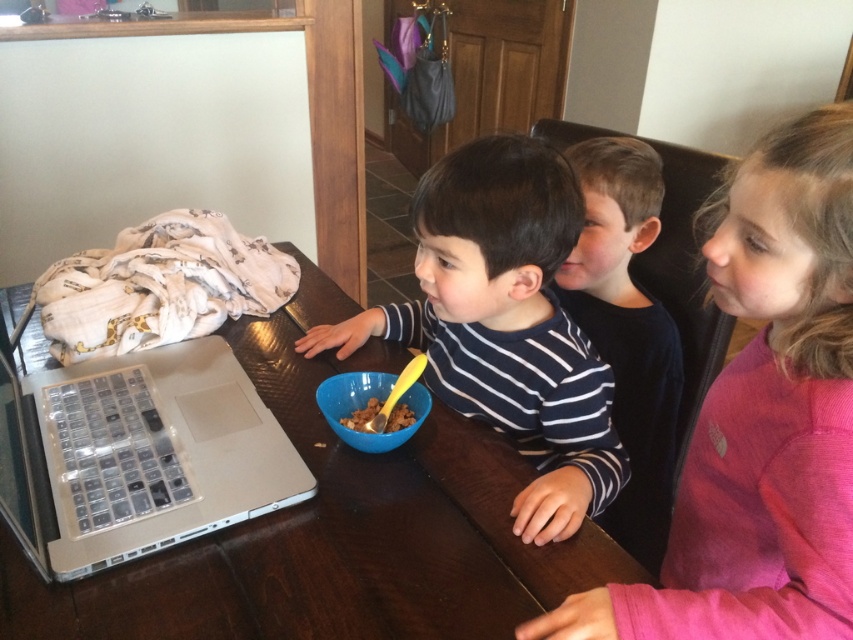
You are a parent trying to clean up after the kids. The brown wooden table at center and brown crumbly cereal at center are both in the dining area. Which object should you clean first if you want to start with the one closer to the entrance?

The brown wooden table at center is positioned on the left side of brown crumbly cereal at center. Since the entrance is typically on the left side of a room, you should clean the brown wooden table at center first.

You are a parent trying to clean up the crumbs from the brown crumbly cereal at center. The vacuum cleaner you have can only reach 20 centimeters. Can you clean the crumbs without moving the brown wooden table at center?

The distance between the brown wooden table at center and the brown crumbly cereal at center is 21.61 centimeters. Since the vacuum cleaner can only reach 20 centimeters, you cannot clean the crumbs without moving the brown wooden table at center.